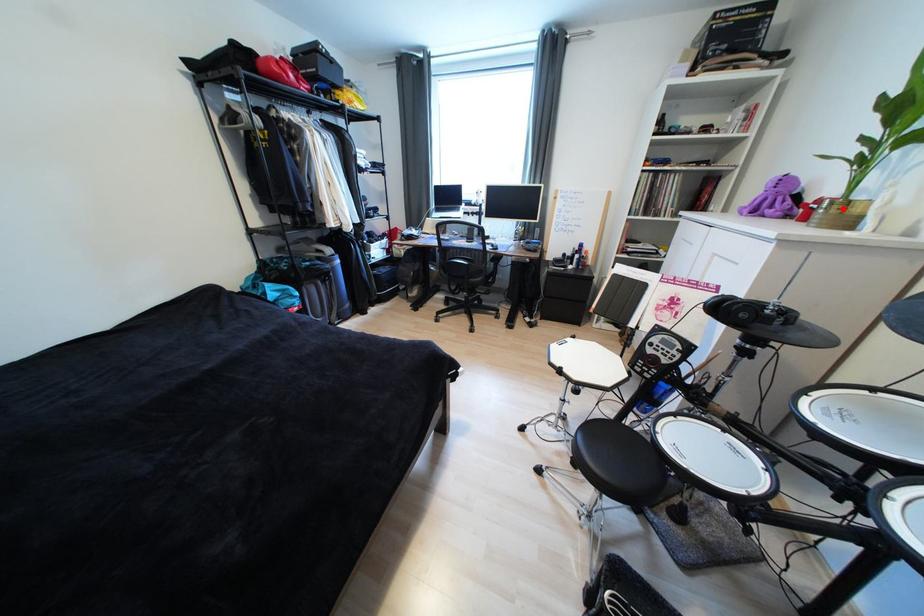
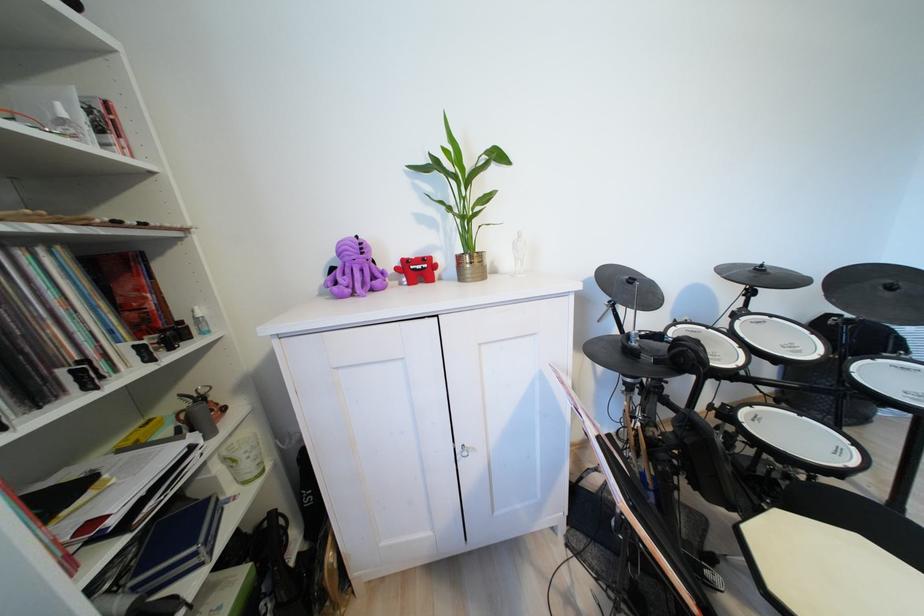
Question: I am providing you with two images of the same scene from different viewpoints. A red point is marked on the first image. At the location where the point appears in image 1, is it still visible in image 2?

Choices:
 (A) Yes
 (B) No

Answer: (A)